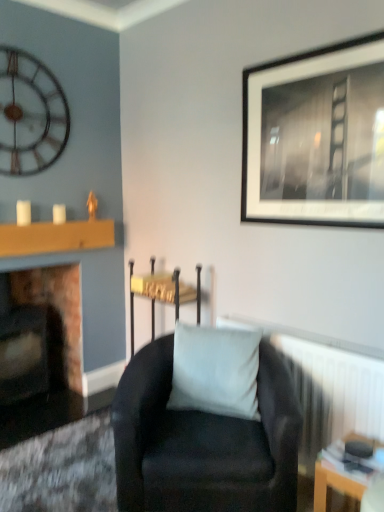
Question: From a real-world perspective, relative to wooden mantle at left, is white textured radiator at lower right vertically above or below?

Choices:
 (A) below
 (B) above

Answer: (A)

Question: Visually, is white textured radiator at lower right positioned to the left or to the right of wooden mantle at left?

Choices:
 (A) right
 (B) left

Answer: (A)

Question: Which is nearer to the metallic wall clock at upper left?

Choices:
 (A) white textured radiator at lower right
 (B) white matte pillow at center
 (C) suede black armchair at center
 (D) marble fireplace at left
 (E) wooden table at lower right

Answer: (D)

Question: Estimate the real-world distances between objects in this image. Which object is farther from the suede black armchair at center?

Choices:
 (A) black matte picture frame at upper right
 (B) velvet black armchair at center
 (C) white matte pillow at center
 (D) marble fireplace at left
 (E) wooden mantle at left

Answer: (E)